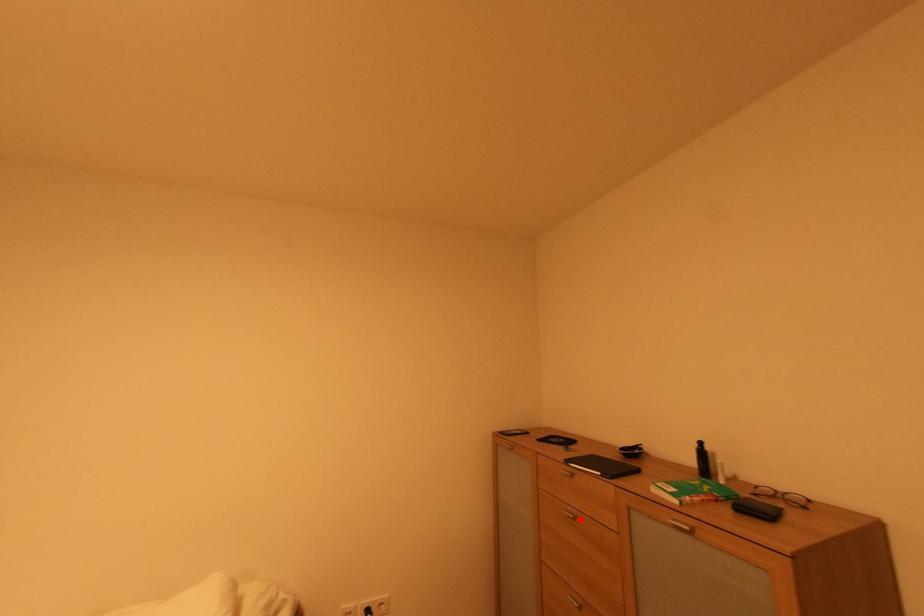
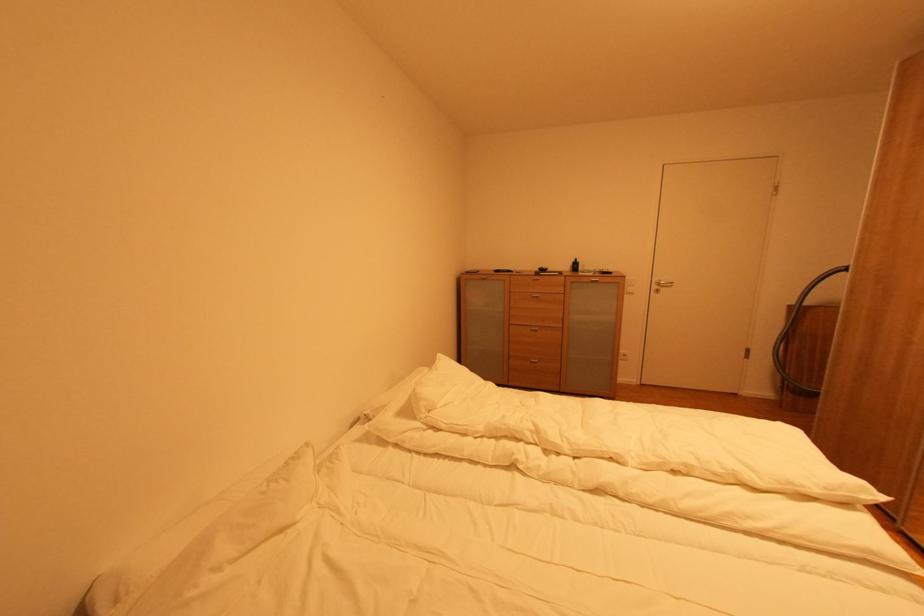
Locate, in the second image, the point that corresponds to the highlighted location in the first image.

(542, 298)